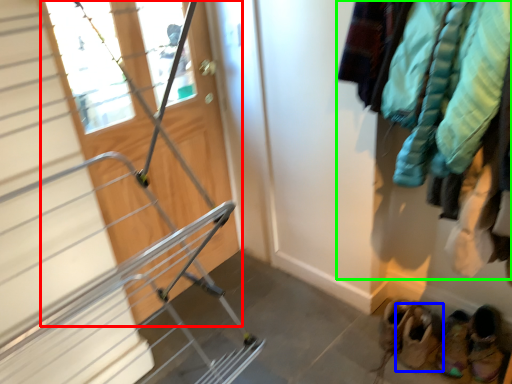
Question: Estimate the real-world distances between objects in this image. Which object is closer to door (highlighted by a red box), footwear (highlighted by a blue box) or clothing (highlighted by a green box)?

Choices:
 (A) footwear
 (B) clothing

Answer: (B)